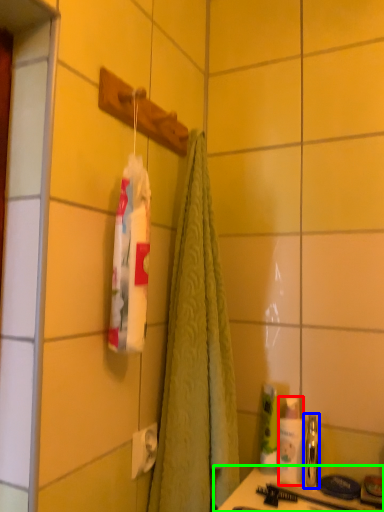
Question: Considering the real-world distances, which object is farthest from toiletry (highlighted by a red box)? mouthwash (highlighted by a blue box) or counter (highlighted by a green box)?

Choices:
 (A) mouthwash
 (B) counter

Answer: (B)